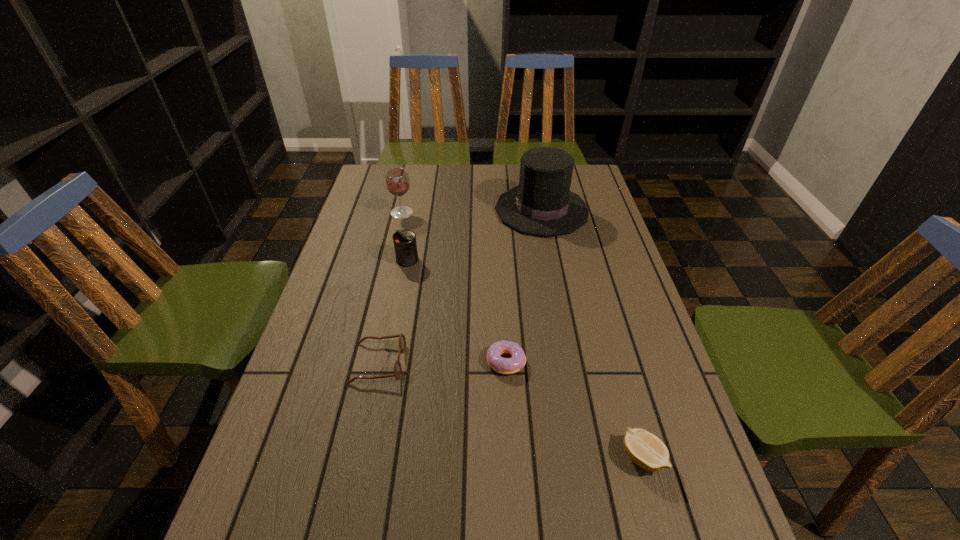
Image resolution: width=960 pixels, height=540 pixels. In order to click on object that is at the far right corner in this screenshot , I will do `click(543, 205)`.

In the image, there is a desktop. Find the location of `vacant space at the far edge`. vacant space at the far edge is located at coordinates (478, 166).

What are the coordinates of `free location at the left edge` in the screenshot? It's located at (346, 323).

In the image, there is a desktop. In order to click on vacant space at the right edge in this screenshot , I will do `click(630, 471)`.

I want to click on free point between the second tallest object and the doughnut, so click(x=454, y=287).

This screenshot has width=960, height=540. I want to click on vacant space in between the doughnut and the lemon, so click(574, 409).

Locate an element on the screen. The width and height of the screenshot is (960, 540). unoccupied position between the lemon and the spectacles is located at coordinates (511, 410).

Locate an element on the screen. The width and height of the screenshot is (960, 540). free spot between the lemon and the spectacles is located at coordinates (511, 410).

In order to click on free point between the lemon and the tallest object in this screenshot , I will do `click(592, 333)`.

This screenshot has width=960, height=540. What are the coordinates of `empty location between the spectacles and the lemon` in the screenshot? It's located at (511, 410).